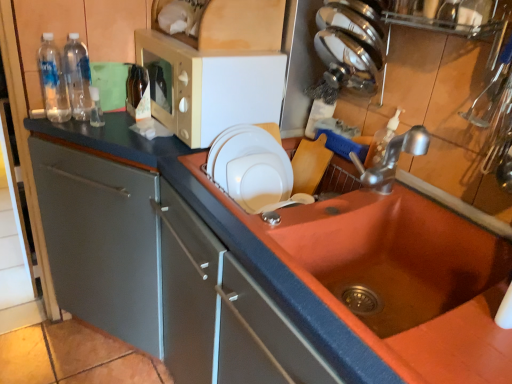
The width and height of the screenshot is (512, 384). Describe the element at coordinates (211, 87) in the screenshot. I see `beige plastic microwave at upper center` at that location.

The width and height of the screenshot is (512, 384). Describe the element at coordinates (387, 257) in the screenshot. I see `matte orange sink at center` at that location.

The width and height of the screenshot is (512, 384). I want to click on clear plastic bottle at left, which is the second bottle from left to right, so click(77, 77).

Locate an element on the screen. The image size is (512, 384). white glossy plate at upper center, the 2th appliance viewed from the right is located at coordinates [250, 167].

Who is taller, clear plastic bottles at left, the third bottle viewed from the right, or matte gray countertop at center?

With more height is matte gray countertop at center.

Is clear plastic bottles at left, placed as the first bottle when sorted from left to right, far from matte gray countertop at center?

That's not correct — clear plastic bottles at left, placed as the first bottle when sorted from left to right, is a little close to matte gray countertop at center.

Which object is further away from the camera taking this photo, clear plastic bottles at left, placed as the first bottle when sorted from left to right, or matte gray countertop at center?

clear plastic bottles at left, placed as the first bottle when sorted from left to right, is behind.

Is clear plastic bottles at left, placed as the first bottle when sorted from left to right, facing towards matte gray countertop at center?

No, clear plastic bottles at left, placed as the first bottle when sorted from left to right, is not facing towards matte gray countertop at center.

From the picture: Which object is positioned more to the right, brown glass bottle at upper left, which is the third bottle from left to right, or matte orange sink at center?

Positioned to the right is matte orange sink at center.

Relative to matte orange sink at center, is brown glass bottle at upper left, which is the third bottle from left to right, in front or behind?

brown glass bottle at upper left, which is the third bottle from left to right, is positioned farther from the viewer than matte orange sink at center.

Does brown glass bottle at upper left, which is the third bottle from left to right, turn towards matte orange sink at center?

Yes, brown glass bottle at upper left, which is the third bottle from left to right, is aimed at matte orange sink at center.

Consider the image. Can you confirm if matte orange sink at center is bigger than brown glass bottle at upper left, which is the third bottle from left to right?

Yes.

Considering the points (319, 277) and (145, 110), which point is in front, point (319, 277) or point (145, 110)?

The point (319, 277) is closer to the camera.

Measure the distance between matte orange sink at center and brown glass bottle at upper left, acting as the 1th bottle starting from the right.

matte orange sink at center is 33.11 inches away from brown glass bottle at upper left, acting as the 1th bottle starting from the right.

Is matte orange sink at center surrounding brown glass bottle at upper left, which is the third bottle from left to right?

Definitely not — brown glass bottle at upper left, which is the third bottle from left to right, is not inside matte orange sink at center.

Can you tell me how much brown glass bottle at upper left, acting as the 1th bottle starting from the right, and matte gray countertop at center differ in facing direction?

The angle between the facing direction of brown glass bottle at upper left, acting as the 1th bottle starting from the right, and the facing direction of matte gray countertop at center is 90 degrees.

Considering the positions of points (134, 88) and (158, 209), is point (134, 88) closer to camera compared to point (158, 209)?

That is False.

Who is bigger, brown glass bottle at upper left, which is the third bottle from left to right, or matte gray countertop at center?

Bigger between the two is matte gray countertop at center.

Between brown glass bottle at upper left, acting as the 1th bottle starting from the right, and matte gray countertop at center, which one is positioned in front?

Positioned in front is matte gray countertop at center.

Between polished stainless steel knives at upper right, which appears as the 2th appliance when ordered from the bottom, and clear plastic bottles at left, the third bottle viewed from the right, which one has more height?

clear plastic bottles at left, the third bottle viewed from the right, is taller.

Based on the photo, how far apart are polished stainless steel knives at upper right, which is counted as the 1th appliance, starting from the right, and clear plastic bottles at left, the third bottle viewed from the right?

polished stainless steel knives at upper right, which is counted as the 1th appliance, starting from the right, is 36.12 inches away from clear plastic bottles at left, the third bottle viewed from the right.

Can you confirm if polished stainless steel knives at upper right, the 1th appliance when ordered from top to bottom, is wider than clear plastic bottles at left, the third bottle viewed from the right?

Correct, the width of polished stainless steel knives at upper right, the 1th appliance when ordered from top to bottom, exceeds that of clear plastic bottles at left, the third bottle viewed from the right.

Based on the photo, which is more to the right, polished stainless steel knives at upper right, the second appliance viewed from the left, or clear plastic bottles at left, the third bottle viewed from the right?

polished stainless steel knives at upper right, the second appliance viewed from the left.

Would you consider silver metallic faucet at upper right to be distant from white glossy plate at upper center, which appears as the 1th appliance when ordered from the bottom?

Actually, silver metallic faucet at upper right and white glossy plate at upper center, which appears as the 1th appliance when ordered from the bottom, are a little close together.

Which is behind, silver metallic faucet at upper right or white glossy plate at upper center, the 2th appliance viewed from the right?

white glossy plate at upper center, the 2th appliance viewed from the right.

Considering the positions of point (391, 140) and point (285, 153), is point (391, 140) closer or farther from the camera than point (285, 153)?

Clearly, point (391, 140) is closer to the camera than point (285, 153).

Considering the sizes of objects silver metallic faucet at upper right and white glossy plate at upper center, the first appliance viewed from the left, in the image provided, who is smaller, silver metallic faucet at upper right or white glossy plate at upper center, the first appliance viewed from the left,?

Smaller between the two is silver metallic faucet at upper right.

From a real-world perspective, which is physically below, matte gray countertop at center or polished stainless steel knives at upper right, which appears as the 2th appliance when ordered from the bottom?

matte gray countertop at center.

Between matte gray countertop at center and polished stainless steel knives at upper right, which appears as the 2th appliance when ordered from the bottom, which one is positioned behind?

matte gray countertop at center is more distant.

I want to click on countertop behind the polished stainless steel knives at upper right, the second appliance viewed from the left, so click(164, 277).

Is matte gray countertop at center at the right side of polished stainless steel knives at upper right, the 1th appliance when ordered from top to bottom?

In fact, matte gray countertop at center is to the left of polished stainless steel knives at upper right, the 1th appliance when ordered from top to bottom.

Starting from the matte gray countertop at center, which bottle is the 1st one behind? Please provide its 2D coordinates.

[(53, 81)]

Find the location of a particular element. Image resolution: width=512 pixels, height=384 pixels. bottle that is the 1st one when counting leftward from the matte orange sink at center is located at coordinates (138, 93).

Estimate the real-world distances between objects in this image. Which object is further from clear plastic bottles at left, placed as the first bottle when sorted from left to right, brown glass bottle at upper left, which is the third bottle from left to right, or matte orange sink at center?

Among the two, matte orange sink at center is located further to clear plastic bottles at left, placed as the first bottle when sorted from left to right.

Considering their positions, is polished stainless steel knives at upper right, the 1th appliance when ordered from top to bottom, positioned further to clear plastic bottles at left, placed as the first bottle when sorted from left to right, than matte gray countertop at center?

The object further to clear plastic bottles at left, placed as the first bottle when sorted from left to right, is polished stainless steel knives at upper right, the 1th appliance when ordered from top to bottom.

Based on their spatial positions, is polished stainless steel knives at upper right, the second appliance viewed from the left, or matte gray countertop at center closer to matte orange sink at center?

matte gray countertop at center.

Based on the photo, from the image, which object appears to be nearer to white glossy plate at upper center, the first appliance viewed from the left, silver metallic faucet at upper right or beige plastic microwave at upper center?

beige plastic microwave at upper center is closer to white glossy plate at upper center, the first appliance viewed from the left.

Considering their positions, is brown glass bottle at upper left, which is the third bottle from left to right, positioned closer to polished stainless steel knives at upper right, which appears as the 2th appliance when ordered from the bottom, than matte orange sink at center?

Among the two, matte orange sink at center is located nearer to polished stainless steel knives at upper right, which appears as the 2th appliance when ordered from the bottom.

Based on their spatial positions, is brown glass bottle at upper left, which is the third bottle from left to right, or matte gray countertop at center closer to polished stainless steel knives at upper right, the second appliance viewed from the left?

Based on the image, brown glass bottle at upper left, which is the third bottle from left to right, appears to be nearer to polished stainless steel knives at upper right, the second appliance viewed from the left.

Estimate the real-world distances between objects in this image. Which object is closer to clear plastic bottle at left, which is the second bottle from right to left, clear plastic bottles at left, placed as the first bottle when sorted from left to right, or polished stainless steel knives at upper right, which is counted as the 1th appliance, starting from the right?

Based on the image, clear plastic bottles at left, placed as the first bottle when sorted from left to right, appears to be nearer to clear plastic bottle at left, which is the second bottle from right to left.

Estimate the real-world distances between objects in this image. Which object is closer to matte gray countertop at center, matte orange sink at center or silver metallic faucet at upper right?

Among the two, matte orange sink at center is located nearer to matte gray countertop at center.

Locate an element on the screen. bottle between clear plastic bottle at left, which is the second bottle from right to left, and polished stainless steel knives at upper right, which appears as the 2th appliance when ordered from the bottom, from left to right is located at coordinates (138, 93).

Identify the location of countertop situated between brown glass bottle at upper left, acting as the 1th bottle starting from the right, and polished stainless steel knives at upper right, the 1th appliance when ordered from top to bottom, from left to right. Image resolution: width=512 pixels, height=384 pixels. (164, 277).

Image resolution: width=512 pixels, height=384 pixels. What are the coordinates of `microwave oven between polished stainless steel knives at upper right, which is counted as the 1th appliance, starting from the right, and matte orange sink at center from top to bottom` in the screenshot? It's located at coord(211,87).

In order to click on microwave oven between clear plastic bottle at left, which is the second bottle from right to left, and matte gray countertop at center from top to bottom in this screenshot , I will do `click(211, 87)`.